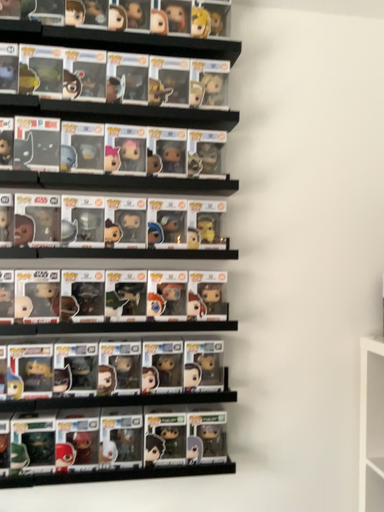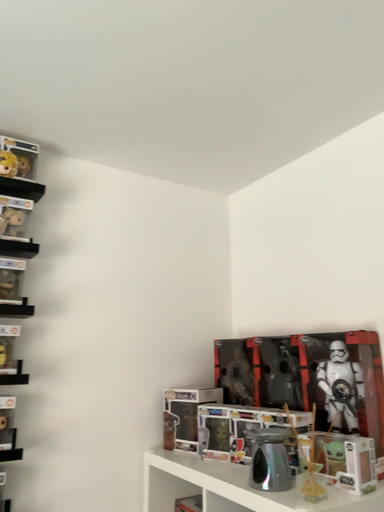
Question: Which way did the camera rotate in the video?

Choices:
 (A) rotated downward
 (B) rotated upward

Answer: (B)